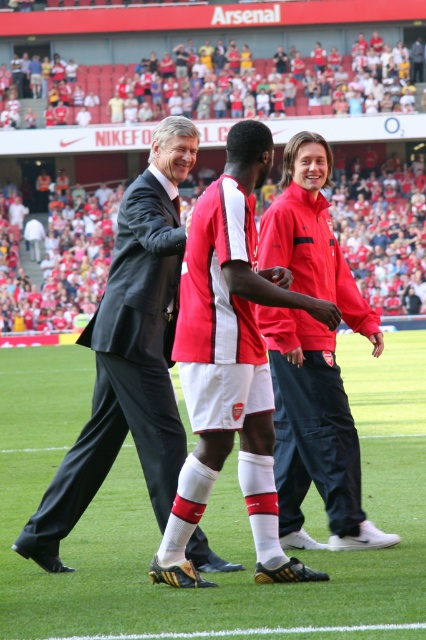
Question: Is red matte soccer jersey at center wider than red matte jacket at center?

Choices:
 (A) no
 (B) yes

Answer: (B)

Question: Is red matte jersey at center smaller than red matte soccer jersey at center?

Choices:
 (A) no
 (B) yes

Answer: (A)

Question: Which object is farther from the camera taking this photo?

Choices:
 (A) red matte jacket at center
 (B) red matte jersey at center
 (C) red matte soccer jersey at center

Answer: (A)

Question: Does red matte jersey at center have a larger size compared to red matte jacket at center?

Choices:
 (A) yes
 (B) no

Answer: (B)

Question: Which of the following is the closest to the observer?

Choices:
 (A) red matte soccer jersey at center
 (B) red matte jacket at center

Answer: (A)

Question: Among these points, which one is farthest from the camera?

Choices:
 (A) (278, 324)
 (B) (236, 161)

Answer: (A)